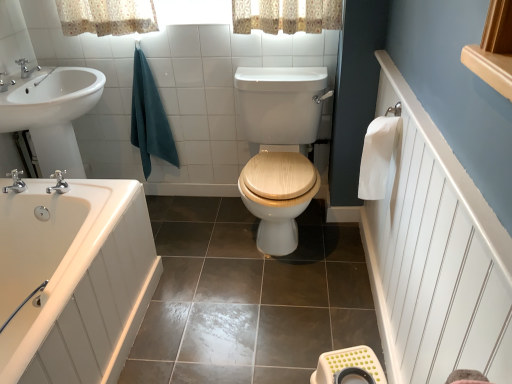
Image resolution: width=512 pixels, height=384 pixels. What are the coordinates of `vacant space behind white plastic stool at lower right` in the screenshot? It's located at (327, 336).